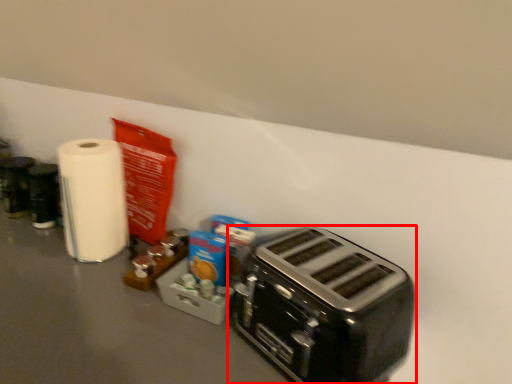
Question: From the image's perspective, where is toaster (annotated by the red box) located relative to paper towel?

Choices:
 (A) below
 (B) above

Answer: (A)